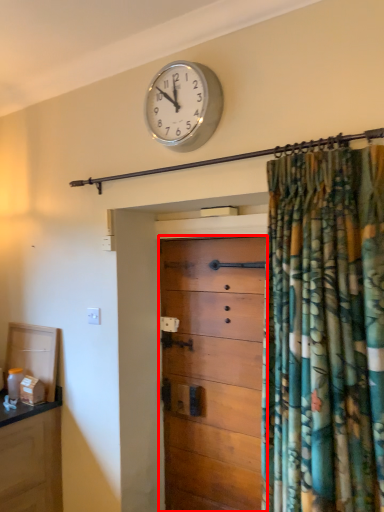
Question: From the image's perspective, where is chest of drawers (annotated by the red box) located in relation to wall clock in the image?

Choices:
 (A) below
 (B) above

Answer: (A)